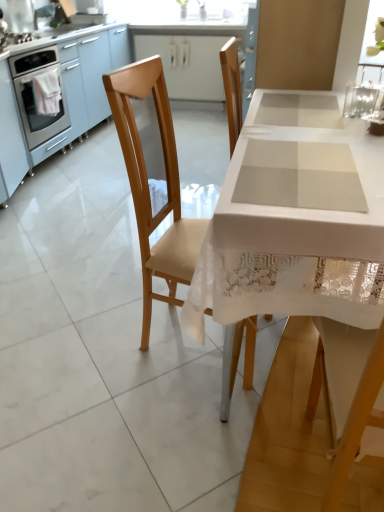
Measure the distance between point [220,38] and camera.

They are 4.16 meters apart.

This screenshot has height=512, width=384. Describe the element at coordinates (47, 93) in the screenshot. I see `pink fabric at left` at that location.

Measure the distance between point (273, 252) and camera.

The distance of point (273, 252) from camera is 38.27 inches.

I want to click on matte white cabinet at upper center, so click(x=187, y=64).

Considering the relative sizes of pink fabric at left and matte white cabinet at upper center in the image provided, is pink fabric at left bigger than matte white cabinet at upper center?

Incorrect, pink fabric at left is not larger than matte white cabinet at upper center.

Image resolution: width=384 pixels, height=512 pixels. What are the coordinates of `cabinetry below the pink fabric at left (from a real-world perspective)` in the screenshot? It's located at click(x=187, y=64).

Can you see pink fabric at left touching matte white cabinet at upper center?

They are not placed beside each other.

Which of these two, pink fabric at left or matte white cabinet at upper center, stands shorter?

With less height is pink fabric at left.

Are wooden chair at left and pink fabric at left located far from each other?

Yes, wooden chair at left and pink fabric at left are located far from each other.

From the image's perspective, between wooden chair at left and pink fabric at left, which one is located above?

pink fabric at left, from the image's perspective.

Is wooden chair at left aimed at pink fabric at left?

No, wooden chair at left is not turned towards pink fabric at left.

Identify the location of cloth on the left of wooden chair at left. (47, 93).

From a real-world perspective, is matte white cabinet at upper center physically above pink fabric at left?

Incorrect, from a real-world perspective, matte white cabinet at upper center is lower than pink fabric at left.

Which object is more forward, matte white cabinet at upper center or pink fabric at left?

pink fabric at left is more forward.

How distant is matte white cabinet at upper center from pink fabric at left?

The distance of matte white cabinet at upper center from pink fabric at left is 1.71 meters.

Consider the image. Is pink fabric at left completely or partially inside matte white cabinet at upper center?

No, pink fabric at left is not surrounded by matte white cabinet at upper center.

In terms of width, does pink fabric at left look wider or thinner when compared to white lace table at center?

pink fabric at left is thinner than white lace table at center.

Is pink fabric at left at the left side of white lace table at center?

Correct, you'll find pink fabric at left to the left of white lace table at center.

Based on the photo, is there a large distance between pink fabric at left and white lace table at center?

pink fabric at left is positioned a significant distance from white lace table at center.

Is point (176, 192) positioned in front of point (205, 98)?

Yes, point (176, 192) is closer to viewer.

Could matte white cabinet at upper center be considered to be inside wooden chair at left?

No, matte white cabinet at upper center is not a part of wooden chair at left.

Is wooden chair at left thinner than matte white cabinet at upper center?

In fact, wooden chair at left might be wider than matte white cabinet at upper center.

Is wooden chair at left far from matte white cabinet at upper center?

That's right, there is a large distance between wooden chair at left and matte white cabinet at upper center.

Looking at their sizes, would you say stainless steel oven at left is wider or thinner than white lace table at center?

stainless steel oven at left is thinner than white lace table at center.

Is stainless steel oven at left facing away from white lace table at center?

That's not correct — stainless steel oven at left is not looking away from white lace table at center.

Is white lace table at center located within stainless steel oven at left?

That's incorrect, white lace table at center is not inside stainless steel oven at left.

Between point (36, 106) and point (321, 288), which one is positioned in front?

Positioned in front is point (321, 288).

Looking at this image, is matte white cabinet at upper center positioned behind wooden chair at left?

Yes, matte white cabinet at upper center is further from the viewer.

From a real-world perspective, is matte white cabinet at upper center positioned above or below wooden chair at left?

matte white cabinet at upper center is below wooden chair at left.

Consider the image. Are matte white cabinet at upper center and wooden chair at left located far from each other?

Indeed, matte white cabinet at upper center is not near wooden chair at left.

Is matte white cabinet at upper center turned away from wooden chair at left?

No, matte white cabinet at upper center is not facing the opposite direction of wooden chair at left.

Where is `cloth above the matte white cabinet at upper center (from a real-world perspective)`? Image resolution: width=384 pixels, height=512 pixels. cloth above the matte white cabinet at upper center (from a real-world perspective) is located at coordinates (47, 93).

Locate an element on the screen. Image resolution: width=384 pixels, height=512 pixels. cloth on the left of wooden chair at left is located at coordinates (47, 93).

Looking at the image, which one is located closer to white lace table at center, wooden chair at left or pink fabric at left?

The object closer to white lace table at center is wooden chair at left.

Considering their positions, is pink fabric at left positioned closer to stainless steel oven at left than white lace table at center?

Among the two, pink fabric at left is located nearer to stainless steel oven at left.

Based on the photo, from the image, which object appears to be nearer to white lace table at center, wooden chair at left or matte white cabinet at upper center?

Based on the image, wooden chair at left appears to be nearer to white lace table at center.

Which object lies nearer to the anchor point white lace table at center, wooden chair at left or stainless steel oven at left?

Based on the image, wooden chair at left appears to be nearer to white lace table at center.

Estimate the real-world distances between objects in this image. Which object is closer to wooden chair at left, matte white cabinet at upper center or pink fabric at left?

pink fabric at left is closer to wooden chair at left.

Which object lies nearer to the anchor point pink fabric at left, white lace table at center or wooden chair at left?

wooden chair at left lies closer to pink fabric at left than the other object.

When comparing their distances from wooden chair at left, does stainless steel oven at left or pink fabric at left seem further?

pink fabric at left is further to wooden chair at left.

Based on their spatial positions, is stainless steel oven at left or matte white cabinet at upper center further from pink fabric at left?

Among the two, matte white cabinet at upper center is located further to pink fabric at left.

You are a GUI agent. You are given a task and a screenshot of the screen. Output one action in this format:
    pyautogui.click(x=<x>, y=<y>)
    Task: Click on the cloth positioned between wooden chair at left and matte white cabinet at upper center from near to far
    The width and height of the screenshot is (384, 512).
    Given the screenshot: What is the action you would take?
    pyautogui.click(x=47, y=93)

Image resolution: width=384 pixels, height=512 pixels. What are the coordinates of `chair between white lace table at center and stainless steel oven at left along the z-axis` in the screenshot? It's located at (149, 184).

You are a GUI agent. You are given a task and a screenshot of the screen. Output one action in this format:
    pyautogui.click(x=<x>, y=<y>)
    Task: Click on the home appliance between wooden chair at left and pink fabric at left along the z-axis
    
    Given the screenshot: What is the action you would take?
    pyautogui.click(x=40, y=95)

Locate an element on the screen. cloth between white lace table at center and matte white cabinet at upper center from front to back is located at coordinates (47, 93).